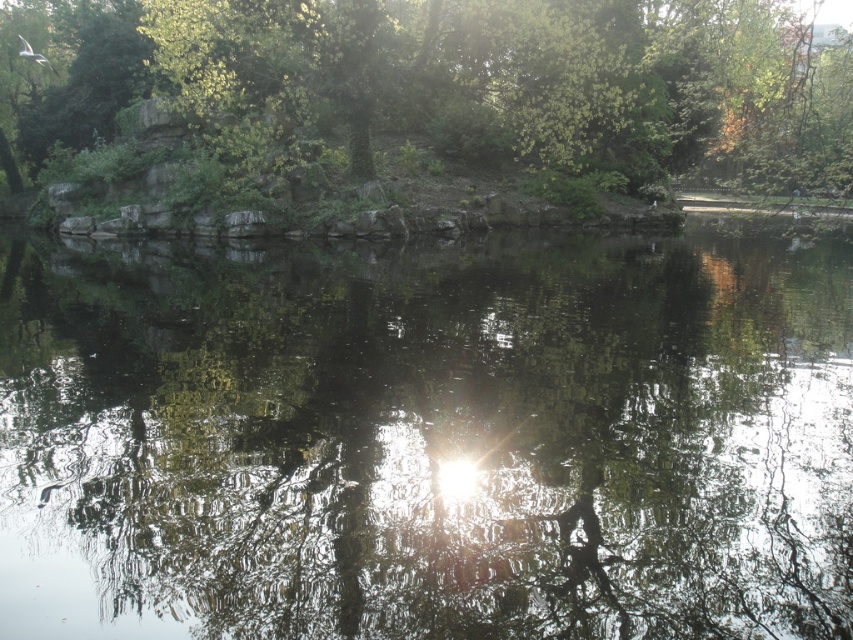
You are standing on the shore of the lake and want to compare the sizes of the transparent water at center and the green leafy tree at upper center. Which one appears wider?

The transparent water at center has a lesser width compared to the green leafy tree at upper center, so the green leafy tree at upper center appears wider.

In the scene shown: You are standing at the origin point in the image. Based on the coordinates given, where is the transparent water at center located?

The transparent water at center is located at the coordinates point (427, 440).

Looking at the serene natural scene, you notice the transparent water at center and the green leafy tree at upper center. Which of these two elements occupies a larger area in the image?

The green leafy tree at upper center occupies a larger area in the image than the transparent water at center.